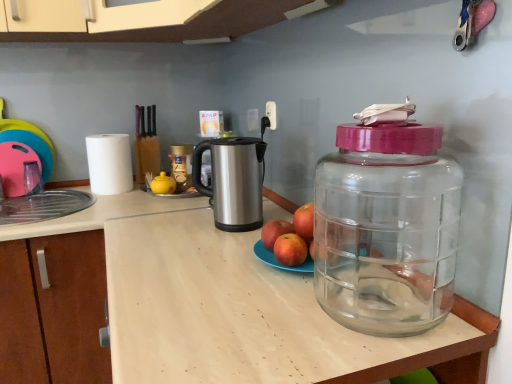
This screenshot has width=512, height=384. I want to click on free spot to the right of red matte apple at center, the 1th apple positioned from the right, so click(355, 257).